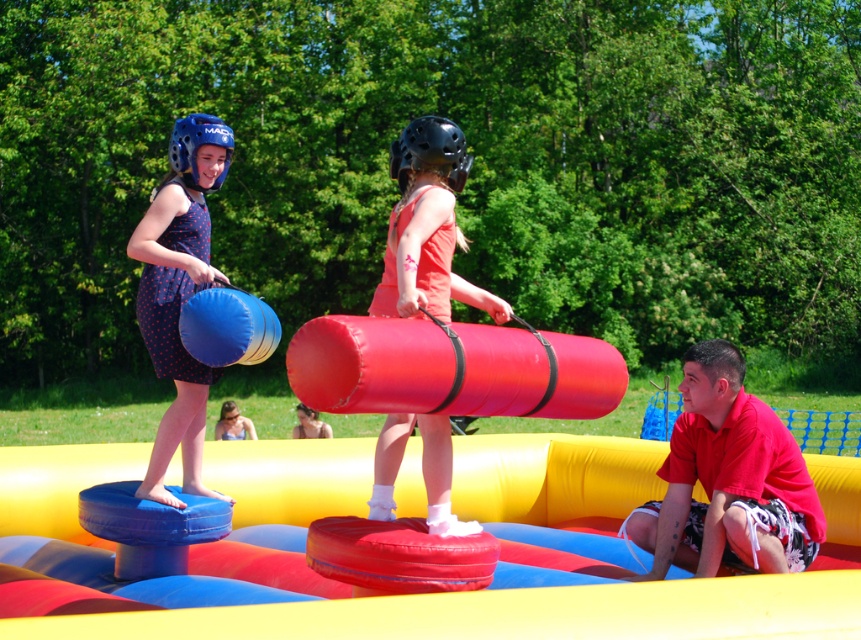
You are a photographer trying to capture a photo of the red cotton shirt at lower right and the blue dotted dress at upper left. Which one should you zoom in on to make them appear the same size in the photo?

The red cotton shirt at lower right is not as tall as blue dotted dress at upper left, so you should zoom in on the red cotton shirt at lower right to make them appear the same size in the photo.